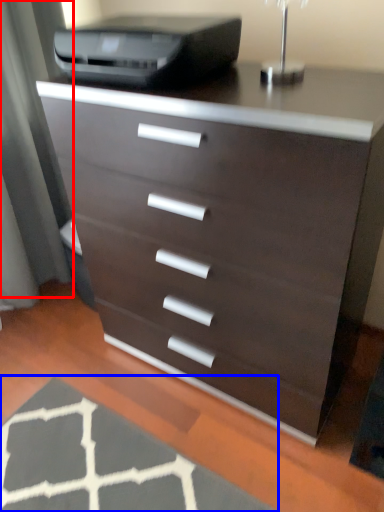
Question: Among these objects, which one is nearest to the camera, screen door (highlighted by a red box) or doormat (highlighted by a blue box)?

Choices:
 (A) screen door
 (B) doormat

Answer: (B)